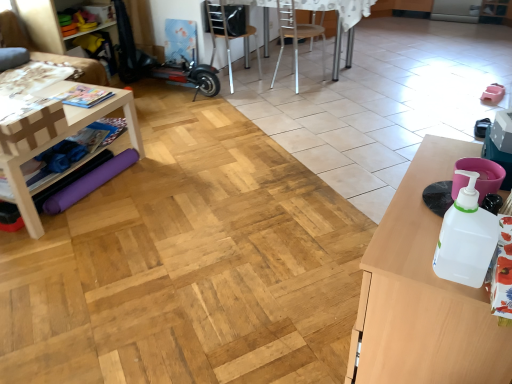
Question: In which direction should I rotate to look at black plastic chair at center, the first chair in the left-to-right sequence?

Choices:
 (A) left
 (B) right

Answer: (A)

Question: Is metallic silver table at center surrounded by wooden table at right, marked as the 2th table in a back-to-front arrangement?

Choices:
 (A) yes
 (B) no

Answer: (B)

Question: Is wooden table at right, which is the 2th table in left-to-right order, closer to camera compared to metallic silver table at center?

Choices:
 (A) no
 (B) yes

Answer: (B)

Question: Is wooden table at right, which is the 2th table in left-to-right order, to the right of metallic silver table at center from the viewer's perspective?

Choices:
 (A) yes
 (B) no

Answer: (A)

Question: From the image's perspective, is wooden table at right, marked as the 2th table in a back-to-front arrangement, located above metallic silver table at center?

Choices:
 (A) no
 (B) yes

Answer: (A)

Question: Is wooden table at right, marked as the first table in a front-to-back arrangement, positioned with its back to metallic silver table at center?

Choices:
 (A) yes
 (B) no

Answer: (B)

Question: Does wooden table at right, marked as the 2th table in a back-to-front arrangement, have a lesser height compared to metallic silver table at center?

Choices:
 (A) no
 (B) yes

Answer: (B)

Question: Is metallic silver table at center looking in the opposite direction of metallic silver chair at center, which ranks as the first chair in right-to-left order?

Choices:
 (A) yes
 (B) no

Answer: (A)

Question: Is metallic silver table at center in contact with metallic silver chair at center, the 2th chair in the left-to-right sequence?

Choices:
 (A) no
 (B) yes

Answer: (A)

Question: Is metallic silver table at center to the left of metallic silver chair at center, which ranks as the first chair in right-to-left order, from the viewer's perspective?

Choices:
 (A) no
 (B) yes

Answer: (A)

Question: Considering the relative positions of metallic silver table at center and metallic silver chair at center, which ranks as the first chair in right-to-left order, in the image provided, is metallic silver table at center to the right of metallic silver chair at center, which ranks as the first chair in right-to-left order, from the viewer's perspective?

Choices:
 (A) no
 (B) yes

Answer: (B)

Question: Is metallic silver table at center smaller than metallic silver chair at center, the 2th chair in the left-to-right sequence?

Choices:
 (A) yes
 (B) no

Answer: (B)

Question: Does metallic silver table at center turn towards metallic silver chair at center, which ranks as the first chair in right-to-left order?

Choices:
 (A) yes
 (B) no

Answer: (A)

Question: Is white plastic bottle at right oriented away from white wood table at left, placed as the second table when sorted from right to left?

Choices:
 (A) no
 (B) yes

Answer: (A)